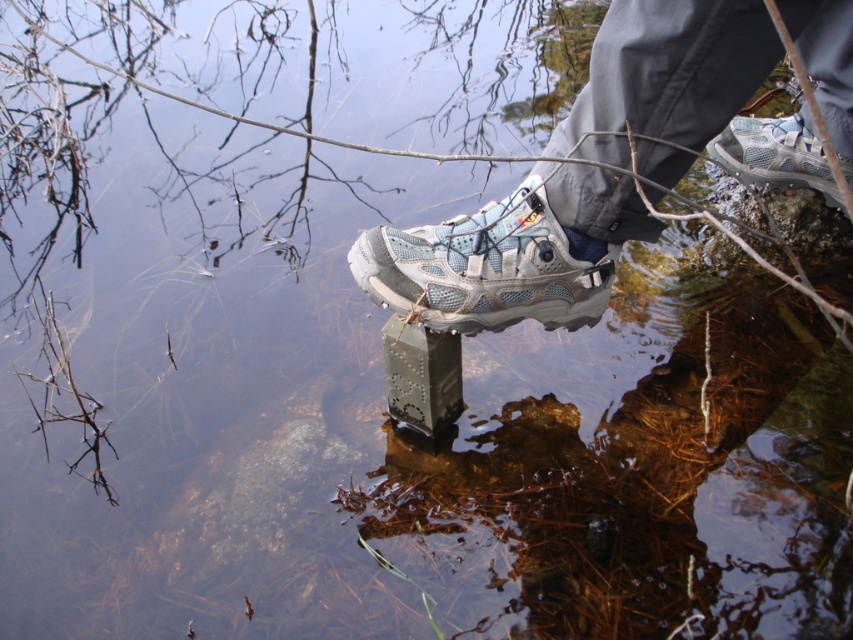
In the scene shown: Between matte gray mesh shoe at center and white mesh shoe at center, which one has more height?

Standing taller between the two is matte gray mesh shoe at center.

Can you confirm if matte gray mesh shoe at center is taller than white mesh shoe at center?

Correct, matte gray mesh shoe at center is much taller as white mesh shoe at center.

Is point (595, 285) positioned in front of point (839, 164)?

Yes, it is in front of point (839, 164).

This screenshot has width=853, height=640. Identify the location of matte gray mesh shoe at center. (486, 268).

Is point (733, 36) positioned after point (775, 173)?

No.

Can you confirm if matte gray shoe at center is taller than white mesh shoe at center?

Correct, matte gray shoe at center is much taller as white mesh shoe at center.

What do you see at coordinates (509, 253) in the screenshot? This screenshot has height=640, width=853. I see `matte gray shoe at center` at bounding box center [509, 253].

Where is `matte gray shoe at center`? matte gray shoe at center is located at coordinates (509, 253).

The height and width of the screenshot is (640, 853). What do you see at coordinates (509, 253) in the screenshot? I see `matte gray shoe at center` at bounding box center [509, 253].

Which is below, matte gray shoe at center or matte gray mesh shoe at center?

matte gray mesh shoe at center is below.

At what (x,y) coordinates should I click in order to perform the action: click on matte gray shoe at center. Please return your answer as a coordinate pair (x, y). Looking at the image, I should click on (509, 253).